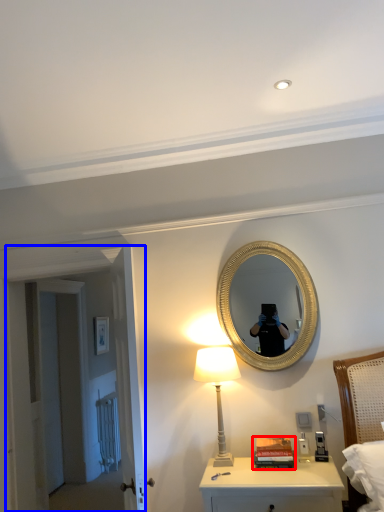
Question: Which of the following is the closest to the observer, book (highlighted by a red box) or door (highlighted by a blue box)?

Choices:
 (A) book
 (B) door

Answer: (A)